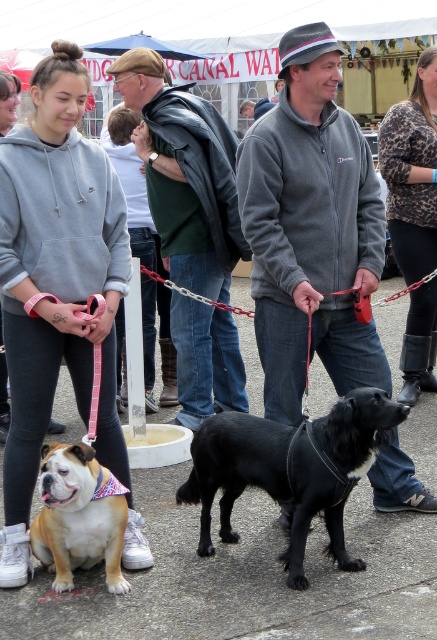
Question: Can you confirm if gray sweatshirt at upper left is positioned to the left of dark gray fleece at center?

Choices:
 (A) yes
 (B) no

Answer: (A)

Question: Which point is farther to the camera?

Choices:
 (A) dark gray fleece at center
 (B) matte white dog at lower left

Answer: (A)

Question: Does leopard print sweater at center have a lesser width compared to matte white dog at lower left?

Choices:
 (A) no
 (B) yes

Answer: (A)

Question: Which point is farther to the camera?

Choices:
 (A) (6, 218)
 (B) (422, 320)
 (C) (58, 465)

Answer: (B)

Question: Is black smooth dog at center positioned behind leopard print sweater at center?

Choices:
 (A) no
 (B) yes

Answer: (A)

Question: Which object is positioned farthest from the dark gray fleece at center?

Choices:
 (A) matte white dog at lower left
 (B) gray sweatshirt at upper left
 (C) black smooth dog at center

Answer: (A)